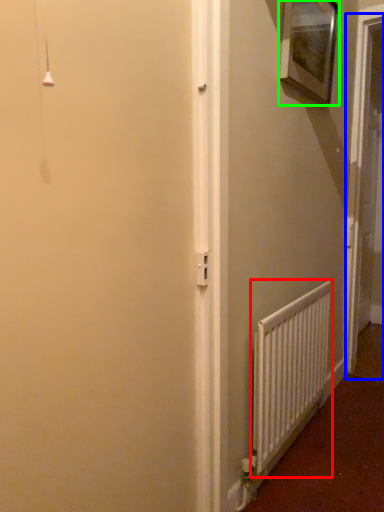
Question: Estimate the real-world distances between objects in this image. Which object is closer to radiator (highlighted by a red box), screen door (highlighted by a blue box) or picture frame (highlighted by a green box)?

Choices:
 (A) screen door
 (B) picture frame

Answer: (A)